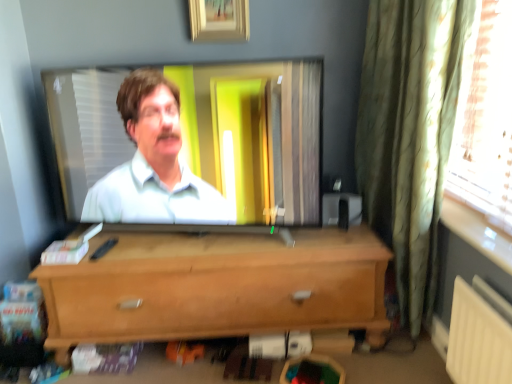
The image size is (512, 384). In order to click on free point above light brown wood chest of drawers at center (from a real-world perspective) in this screenshot , I will do `click(223, 249)`.